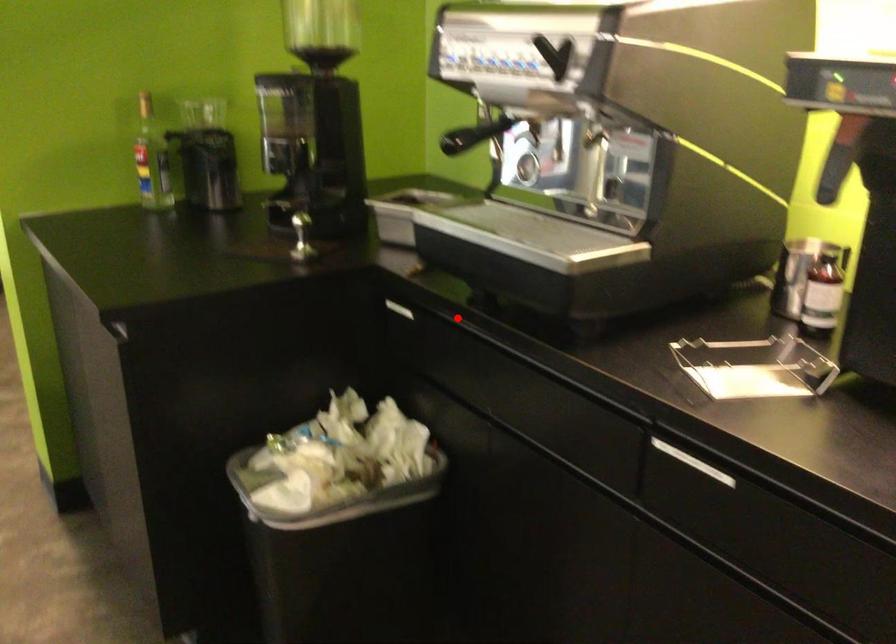
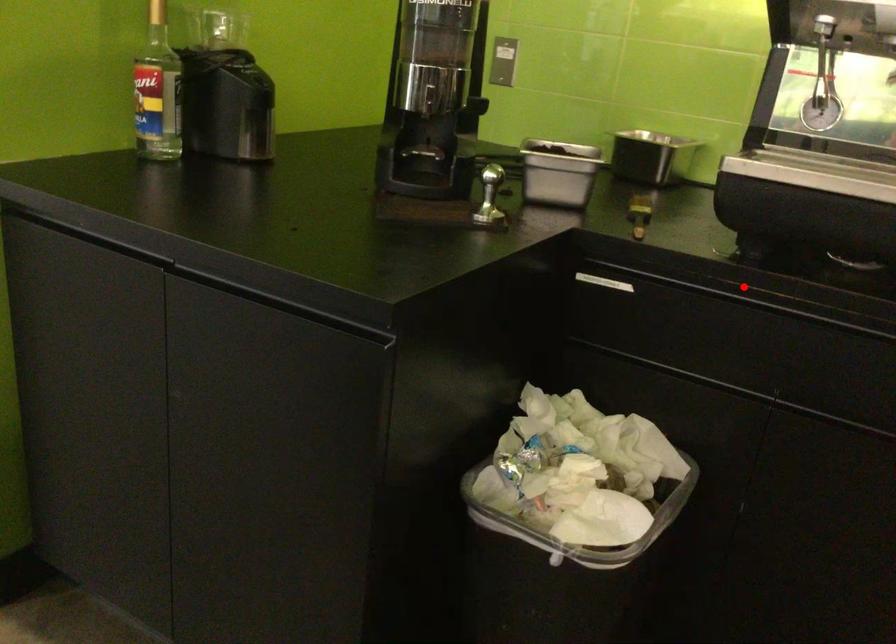
I am providing you with two images of the same scene from different viewpoints. A red point is marked on the first image and another point is marked on the second image. Does the point marked in image1 correspond to the same location as the one in image2?

Yes